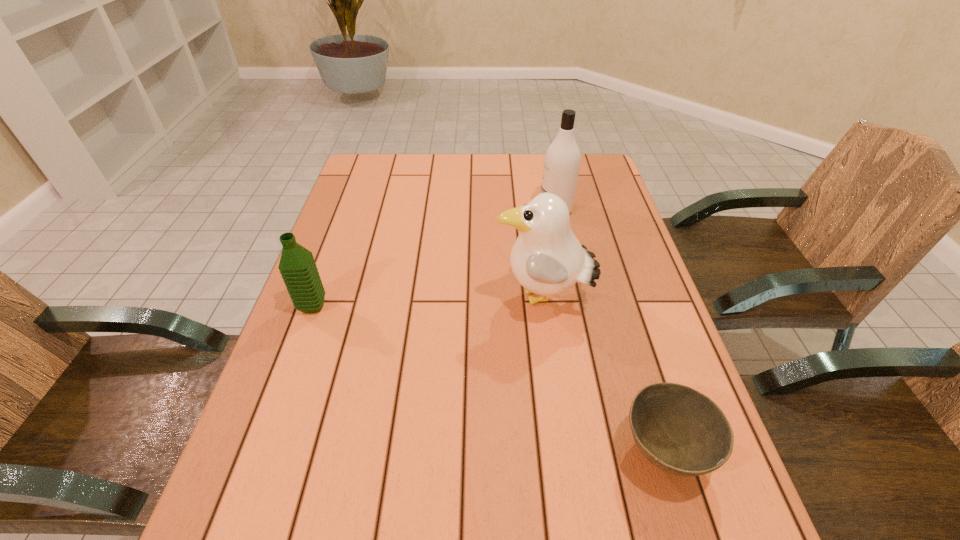
I want to click on vacant point located between the nearest object and the gull, so click(603, 375).

This screenshot has width=960, height=540. In order to click on object that ranks as the third closest to the second shortest object in this screenshot , I will do 678,429.

Identify which object is the nearest to the gull. Please provide its 2D coordinates. Your answer should be formatted as a tuple, i.e. [(x, y)], where the tuple contains the x and y coordinates of a point satisfying the conditions above.

[(678, 429)]

What are the coordinates of `free point that satisfies the following two spatial constraints: 1. on the front-facing side of the shampoo; 2. on the left side of the bowl` in the screenshot? It's located at (606, 451).

The height and width of the screenshot is (540, 960). Find the location of `vacant point that satisfies the following two spatial constraints: 1. on the front-facing side of the shampoo; 2. on the right side of the nearest object`. vacant point that satisfies the following two spatial constraints: 1. on the front-facing side of the shampoo; 2. on the right side of the nearest object is located at coordinates (606, 451).

This screenshot has height=540, width=960. Find the location of `vacant area that satisfies the following two spatial constraints: 1. on the back side of the shortest object; 2. on the beak of the gull`. vacant area that satisfies the following two spatial constraints: 1. on the back side of the shortest object; 2. on the beak of the gull is located at coordinates (616, 299).

The height and width of the screenshot is (540, 960). In order to click on free region that satisfies the following two spatial constraints: 1. on the back side of the nearest object; 2. on the front-facing side of the farthest object in this screenshot , I will do tap(589, 210).

This screenshot has height=540, width=960. Find the location of `vacant space that satisfies the following two spatial constraints: 1. on the front-facing side of the shortest object; 2. on the right side of the shampoo`. vacant space that satisfies the following two spatial constraints: 1. on the front-facing side of the shortest object; 2. on the right side of the shampoo is located at coordinates (606, 451).